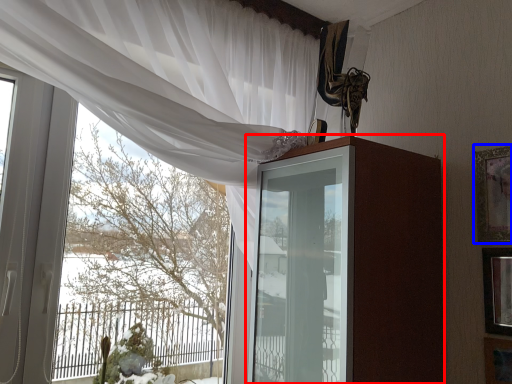
Question: Which of the following is the closest to the observer, dresser (highlighted by a red box) or picture frame (highlighted by a blue box)?

Choices:
 (A) dresser
 (B) picture frame

Answer: (A)